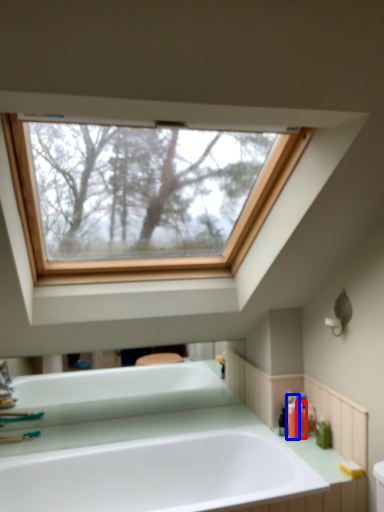
Question: Which of the following is the farthest to the observer, toiletry (highlighted by a red box) or toiletry (highlighted by a blue box)?

Choices:
 (A) toiletry
 (B) toiletry

Answer: (A)